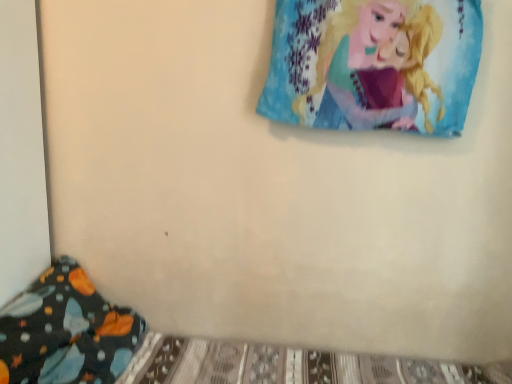
Question: Considering the relative positions of dark blue fabric pillow at lower left and blue fabric pillow at upper right in the image provided, is dark blue fabric pillow at lower left to the left or to the right of blue fabric pillow at upper right?

Choices:
 (A) right
 (B) left

Answer: (B)

Question: Considering their positions, is dark blue fabric pillow at lower left located in front of or behind blue fabric pillow at upper right?

Choices:
 (A) behind
 (B) front

Answer: (B)

Question: Choose the correct answer: Is dark blue fabric pillow at lower left inside blue fabric pillow at upper right or outside it?

Choices:
 (A) outside
 (B) inside

Answer: (A)

Question: Considering the positions of point (362, 29) and point (10, 365), is point (362, 29) closer or farther from the camera than point (10, 365)?

Choices:
 (A) closer
 (B) farther

Answer: (B)

Question: From the image's perspective, relative to dark blue fabric pillow at lower left, is blue fabric pillow at upper right above or below?

Choices:
 (A) below
 (B) above

Answer: (B)

Question: Considering the relative positions of blue fabric pillow at upper right and dark blue fabric pillow at lower left in the image provided, is blue fabric pillow at upper right to the left or to the right of dark blue fabric pillow at lower left?

Choices:
 (A) right
 (B) left

Answer: (A)

Question: Is blue fabric pillow at upper right wider or thinner than dark blue fabric pillow at lower left?

Choices:
 (A) wide
 (B) thin

Answer: (B)